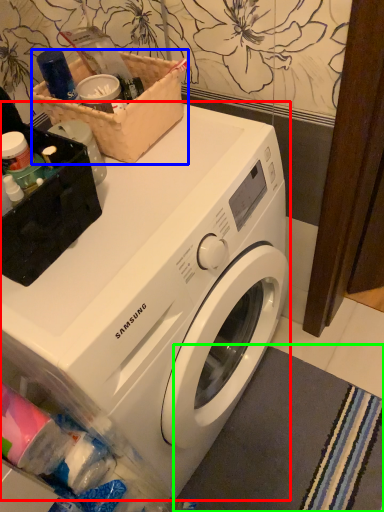
Question: Which is farther away from washing machine (highlighted by a red box)? basket (highlighted by a blue box) or bath mat (highlighted by a green box)?

Choices:
 (A) basket
 (B) bath mat

Answer: (B)